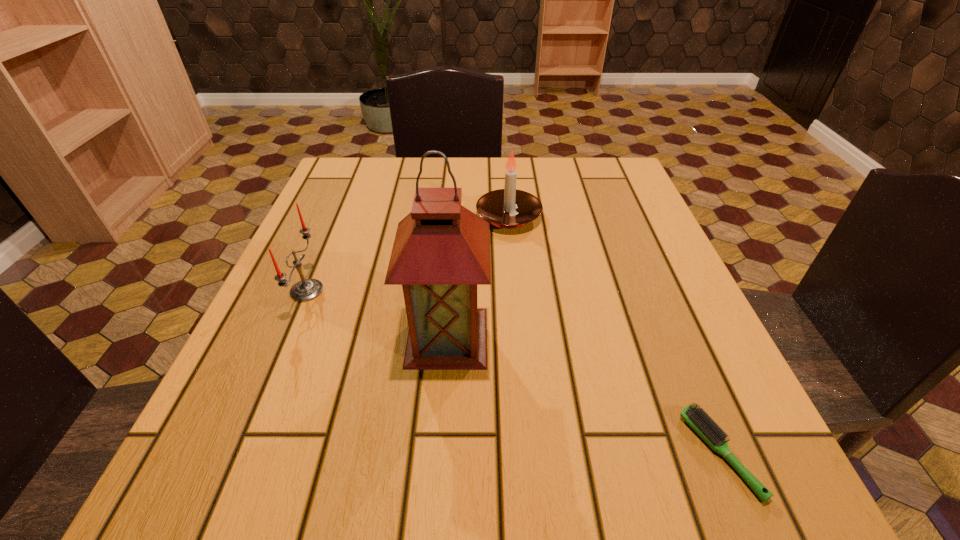
The image size is (960, 540). I want to click on free space at the far left corner of the desktop, so click(x=373, y=169).

The height and width of the screenshot is (540, 960). I want to click on free location at the far right corner of the desktop, so (621, 159).

This screenshot has width=960, height=540. I want to click on vacant space that's between the nearest object and the left candle, so click(514, 372).

At what (x,y) coordinates should I click in order to perform the action: click on free point between the shortest object and the right candle. Please return your answer as a coordinate pair (x, y). Looking at the image, I should click on (614, 335).

The image size is (960, 540). What are the coordinates of `empty location between the nearest object and the tallest object` in the screenshot? It's located at (584, 395).

Where is `free space between the farther candle and the hairbrush`? free space between the farther candle and the hairbrush is located at coordinates (614, 335).

What are the coordinates of `vacant area between the leftmost object and the tallest object` in the screenshot? It's located at (377, 314).

Identify the location of vacant space that's between the hairbrush and the nearer candle. (x=514, y=372).

I want to click on unoccupied area between the leftmost object and the tallest object, so click(377, 314).

The width and height of the screenshot is (960, 540). What are the coordinates of `the closest object to the nearer candle` in the screenshot? It's located at (441, 252).